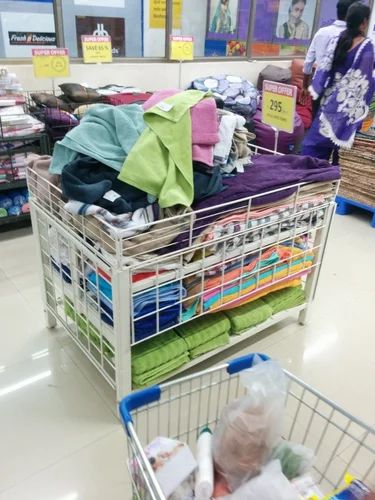
The width and height of the screenshot is (375, 500). In order to click on poster of females in this screenshot , I will do `click(296, 21)`, `click(230, 13)`.